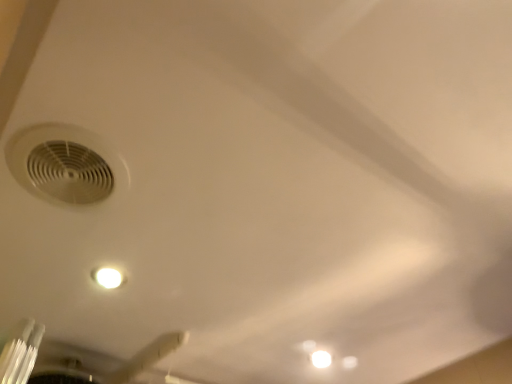
Question: Is white matte air conditioning at upper left oriented away from white matte ceiling fan at lower left?

Choices:
 (A) yes
 (B) no

Answer: (B)

Question: Does white matte air conditioning at upper left touch white matte ceiling fan at lower left?

Choices:
 (A) yes
 (B) no

Answer: (B)

Question: From the image's perspective, is white matte air conditioning at upper left beneath white matte ceiling fan at lower left?

Choices:
 (A) no
 (B) yes

Answer: (A)

Question: Is white matte air conditioning at upper left thinner than white matte ceiling fan at lower left?

Choices:
 (A) yes
 (B) no

Answer: (A)

Question: Considering the relative sizes of white matte air conditioning at upper left and white matte ceiling fan at lower left in the image provided, is white matte air conditioning at upper left taller than white matte ceiling fan at lower left?

Choices:
 (A) yes
 (B) no

Answer: (B)

Question: Is white matte air conditioning at upper left smaller than white matte ceiling fan at lower left?

Choices:
 (A) no
 (B) yes

Answer: (B)

Question: Is white matte ceiling fan at lower left not near white matte air conditioning at upper left?

Choices:
 (A) yes
 (B) no

Answer: (B)

Question: Is white matte ceiling fan at lower left facing away from white matte air conditioning at upper left?

Choices:
 (A) yes
 (B) no

Answer: (B)

Question: Can you confirm if white matte ceiling fan at lower left is positioned to the right of white matte air conditioning at upper left?

Choices:
 (A) yes
 (B) no

Answer: (B)

Question: Is the position of white matte ceiling fan at lower left more distant than that of white matte air conditioning at upper left?

Choices:
 (A) yes
 (B) no

Answer: (A)

Question: From a real-world perspective, is white matte ceiling fan at lower left below white matte air conditioning at upper left?

Choices:
 (A) yes
 (B) no

Answer: (A)

Question: Is white matte ceiling fan at lower left positioned beyond the bounds of white matte air conditioning at upper left?

Choices:
 (A) yes
 (B) no

Answer: (A)

Question: From a real-world perspective, is white matte air conditioning at upper left physically located above or below white matte ceiling fan at lower left?

Choices:
 (A) below
 (B) above

Answer: (B)